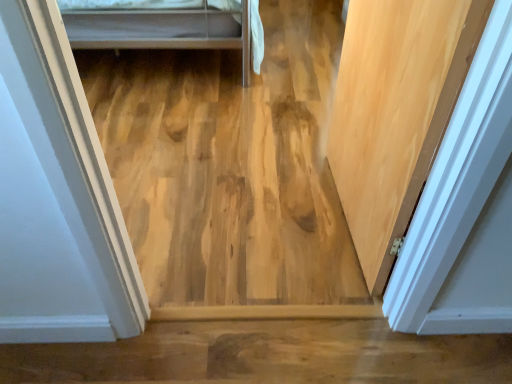
Image resolution: width=512 pixels, height=384 pixels. I want to click on vacant space behind natural wood door at right, so coord(292,142).